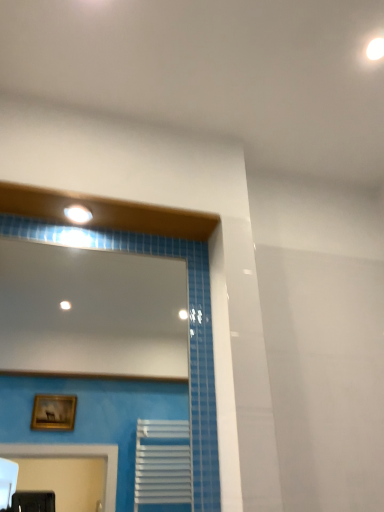
Question: Should I look upward or downward to see white glossy mirror at upper center?

Choices:
 (A) up
 (B) down

Answer: (B)